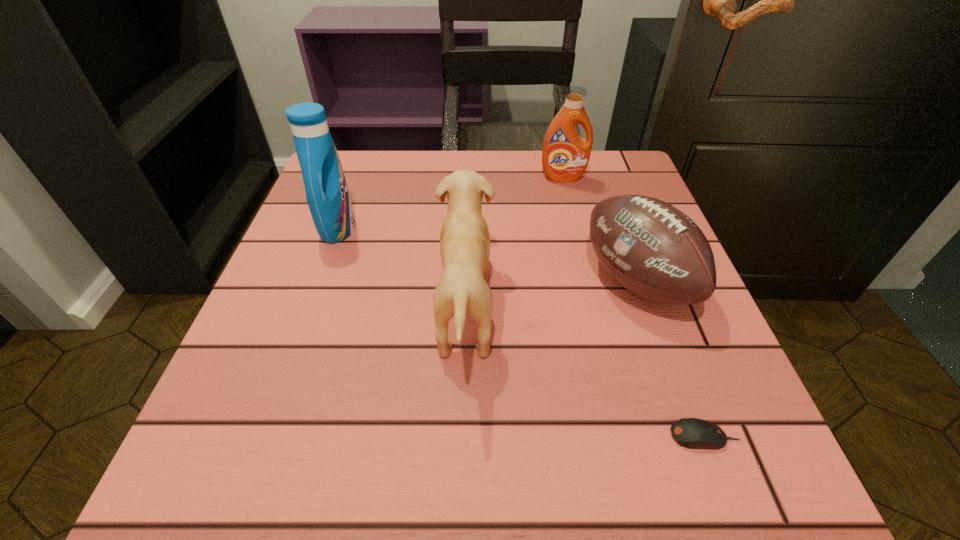
Find the location of `blank space that satisfies the following two spatial constraints: 1. on the front-facing side of the nearer detergent; 2. on the left side of the computer mouse`. blank space that satisfies the following two spatial constraints: 1. on the front-facing side of the nearer detergent; 2. on the left side of the computer mouse is located at coordinates (263, 436).

Locate an element on the screen. The height and width of the screenshot is (540, 960). free region that satisfies the following two spatial constraints: 1. on the left side of the nearest object; 2. on the left side of the fourth object from right to left is located at coordinates (462, 436).

Find the location of a particular element. The height and width of the screenshot is (540, 960). free space that satisfies the following two spatial constraints: 1. on the left side of the fourth object from right to left; 2. on the left side of the computer mouse is located at coordinates (462, 436).

I want to click on free space in the image that satisfies the following two spatial constraints: 1. on the front-facing side of the shortest object; 2. on the right side of the farthest object, so click(x=625, y=436).

The image size is (960, 540). In order to click on free space that satisfies the following two spatial constraints: 1. on the back side of the second shortest object; 2. on the front-facing side of the tallest object in this screenshot , I will do `click(617, 228)`.

This screenshot has width=960, height=540. What are the coordinates of `free space that satisfies the following two spatial constraints: 1. on the front-facing side of the tallest object; 2. on the left side of the nearest object` in the screenshot? It's located at 263,436.

The height and width of the screenshot is (540, 960). Identify the location of free region that satisfies the following two spatial constraints: 1. on the left side of the nearest object; 2. on the left side of the puppy. (462, 436).

Where is `free space that satisfies the following two spatial constraints: 1. on the left side of the second object from left to right; 2. on the left side of the computer mouse`? This screenshot has width=960, height=540. free space that satisfies the following two spatial constraints: 1. on the left side of the second object from left to right; 2. on the left side of the computer mouse is located at coordinates (462, 436).